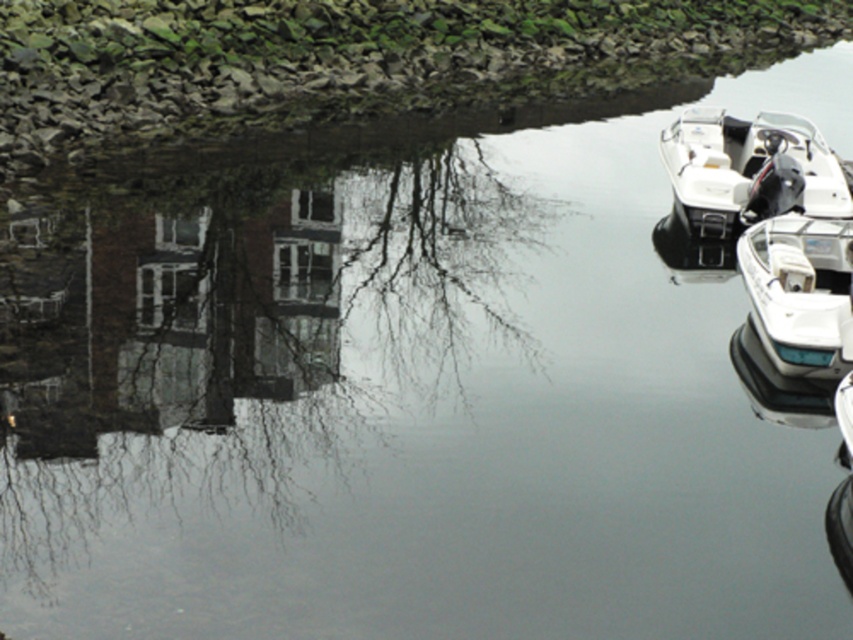
You are a photographer planning to capture the reflection of the boats in the water. Since the water surface is perfectly still, you notice that the reflection of the white plastic boat at right and the white glossy boat at right might overlap. Which boat do you think will have its reflection appear higher in the water?

The white plastic boat at right is positioned over the white glossy boat at right, so its reflection will appear higher in the water.

You are a delivery drone that needs to fly between the white plastic boat at right and the white glossy boat at right. What is the minimum distance you need to cover to move from one to the other?

The white plastic boat at right and white glossy boat at right are 6.08 meters apart, so the minimum distance you need to cover is 6.08 meters.